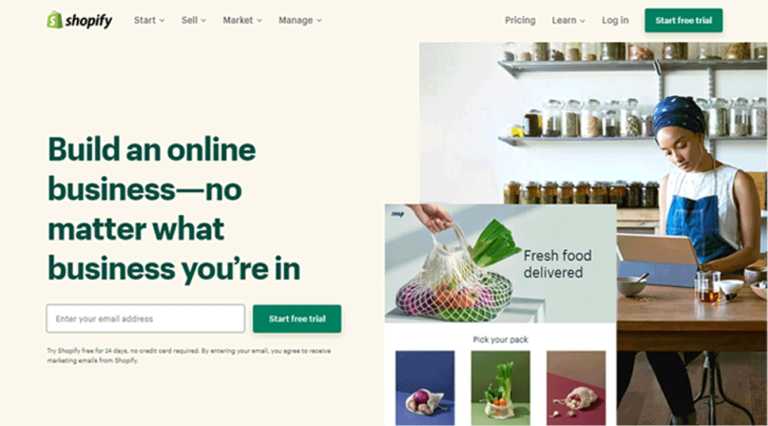
This screenshot has width=768, height=426. Identify the location of laptop. (657, 252).